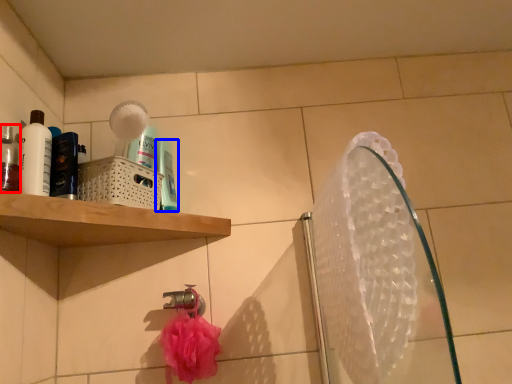
Question: Which point is further to the camera, mouthwash (highlighted by a red box) or mouthwash (highlighted by a blue box)?

Choices:
 (A) mouthwash
 (B) mouthwash

Answer: (B)